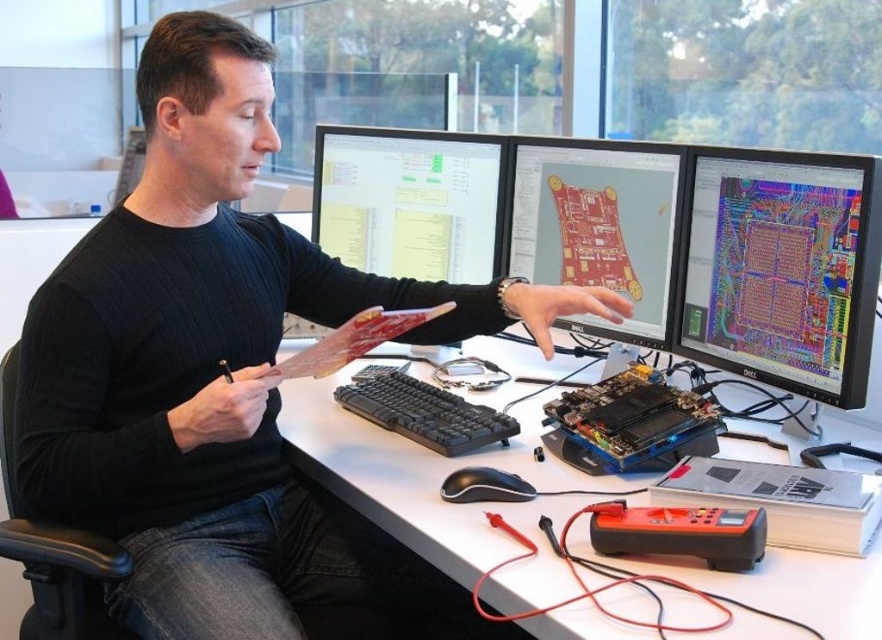
Can you confirm if white plastic computer desk at center is positioned to the left of black plastic keyboard at center?

No, white plastic computer desk at center is not to the left of black plastic keyboard at center.

Does white plastic computer desk at center have a lesser height compared to black plastic keyboard at center?

Incorrect, white plastic computer desk at center's height does not fall short of black plastic keyboard at center's.

At what (x,y) coordinates should I click in order to perform the action: click on white plastic computer desk at center. Please return your answer as a coordinate pair (x, y). The height and width of the screenshot is (640, 882). Looking at the image, I should click on (438, 490).

Locate an element on the screen. white plastic computer desk at center is located at coordinates (438, 490).

Which of these two, matte black shirt at center or matte black monitor at right, stands shorter?

matte black monitor at right is shorter.

Does point (475, 627) lie behind point (699, 288)?

Yes, it is.

This screenshot has height=640, width=882. What do you see at coordinates (220, 371) in the screenshot? I see `matte black shirt at center` at bounding box center [220, 371].

This screenshot has height=640, width=882. What are the coordinates of `matte black shirt at center` in the screenshot? It's located at (220, 371).

Who is more forward, (851, 636) or (715, 269)?

Point (851, 636) is in front.

Can you confirm if white plastic computer desk at center is smaller than matte black monitor at right?

No.

Between point (778, 630) and point (749, 228), which one is positioned behind?

Positioned behind is point (749, 228).

Where is `white plastic computer desk at center`? white plastic computer desk at center is located at coordinates (438, 490).